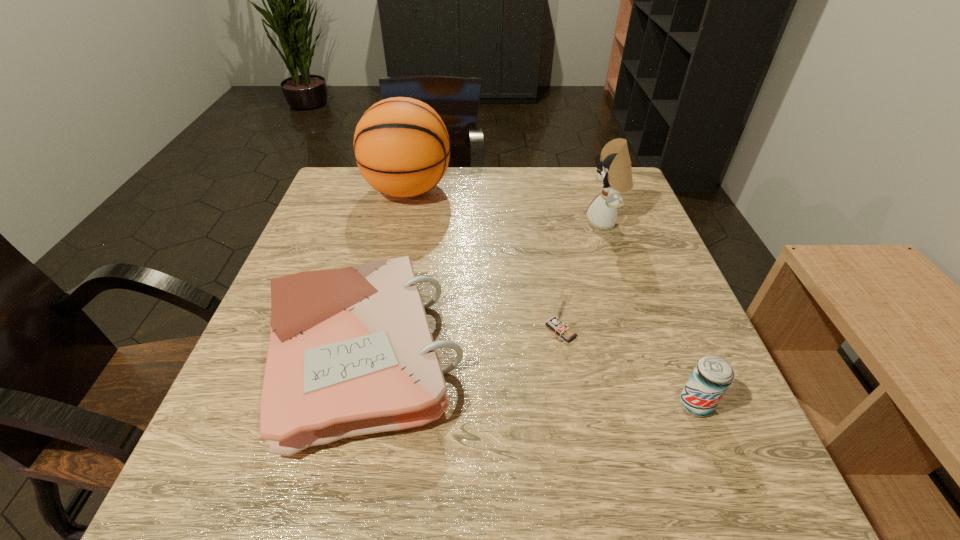
Identify which object is located as the nearest to the basketball. Please provide its 2D coordinates. Your answer should be formatted as a tuple, i.e. [(x, y)], where the tuple contains the x and y coordinates of a point satisfying the conditions above.

[(351, 352)]